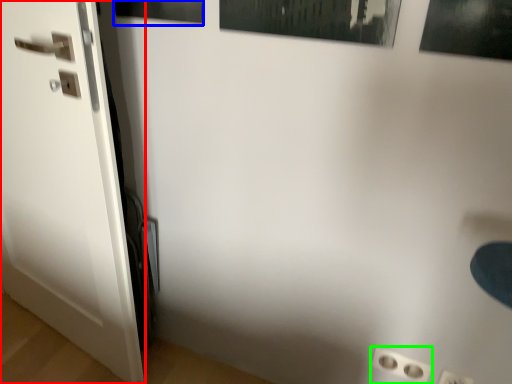
Question: Which is nearer to the door (highlighted by a red box)? picture frame (highlighted by a blue box) or electric outlet (highlighted by a green box).

Choices:
 (A) picture frame
 (B) electric outlet

Answer: (A)